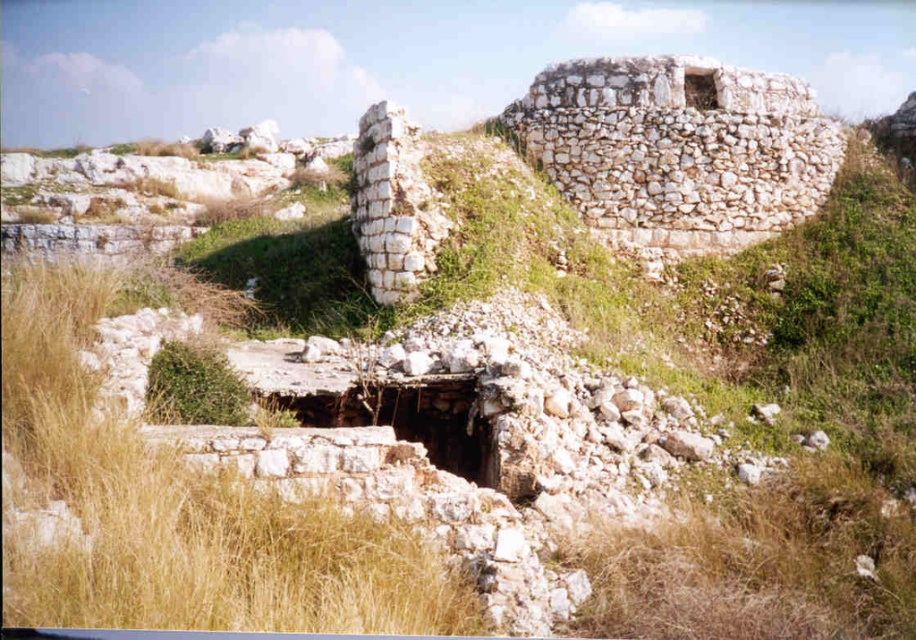
Is point (22, 589) positioned behind point (396, 284)?

No, it is in front of (396, 284).

Does dry grass at center appear on the left side of white stone wall at center?

Indeed, dry grass at center is positioned on the left side of white stone wall at center.

Is point (313, 579) behind point (357, 156)?

That is False.

Find the location of a particular element. This screenshot has height=640, width=916. dry grass at center is located at coordinates (181, 512).